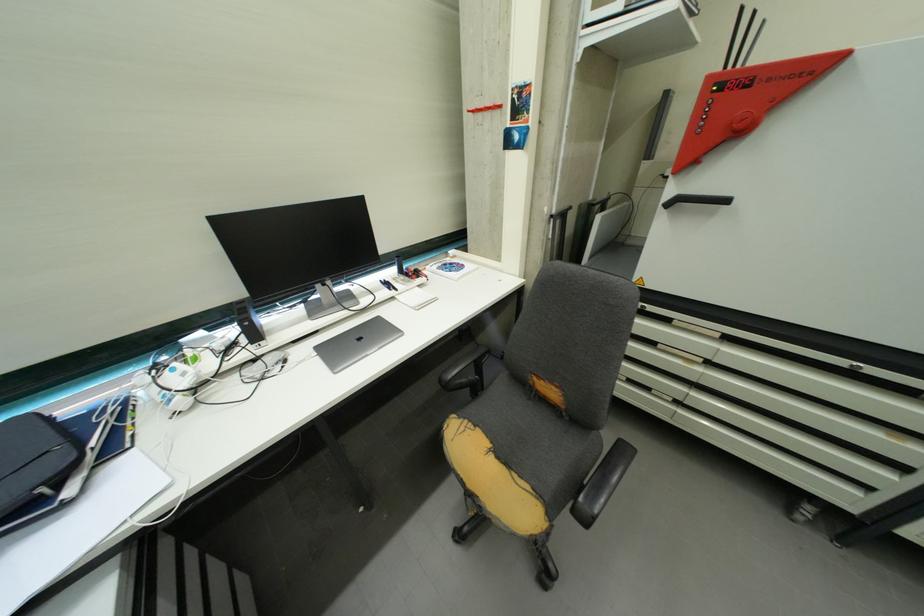
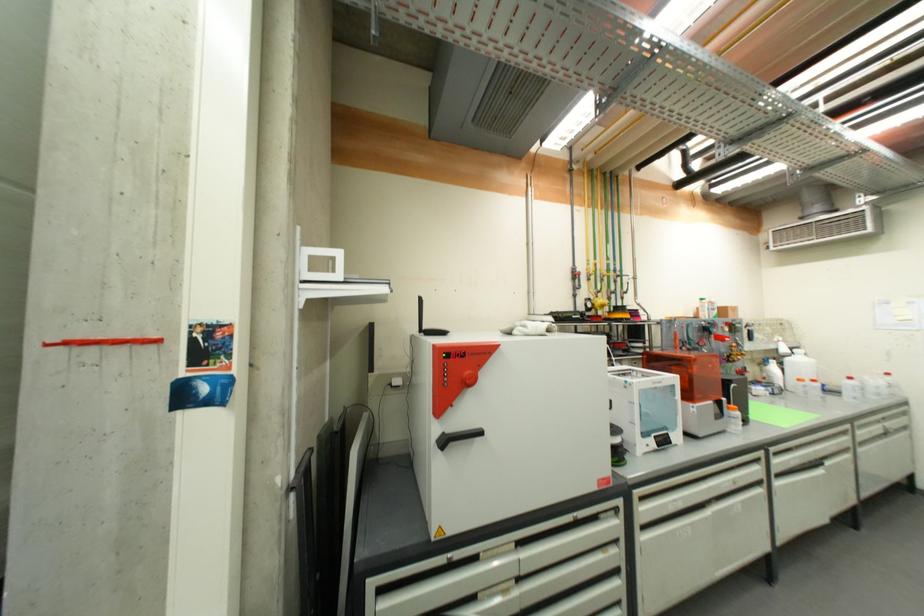
Find the pixel in the second image that matches (747,123) in the first image.

(476, 381)